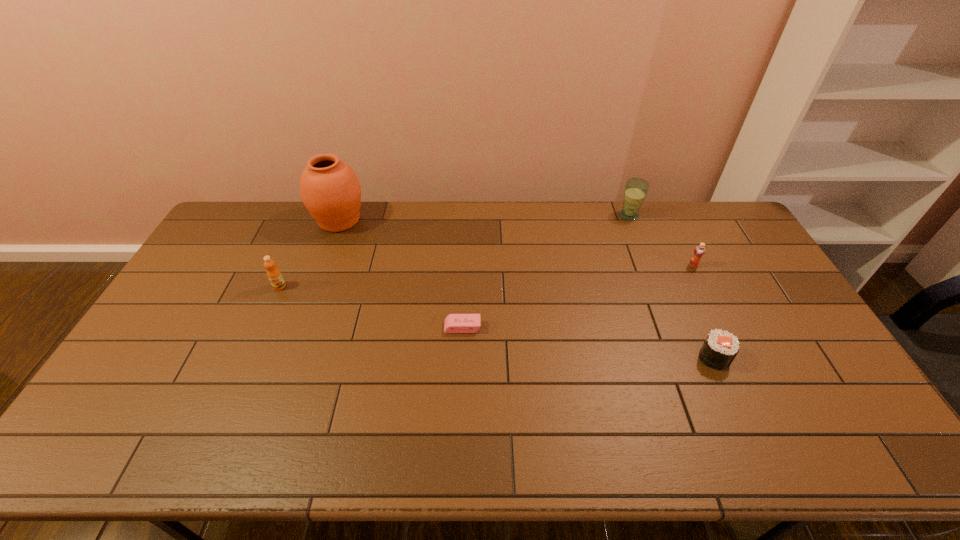
The height and width of the screenshot is (540, 960). In order to click on vacant space at the left edge in this screenshot , I will do `click(204, 303)`.

In the image, there is a desktop. Identify the location of vacant space at the right edge. The width and height of the screenshot is (960, 540). (771, 359).

The width and height of the screenshot is (960, 540). I want to click on free space between the nearest object and the eraser, so click(x=588, y=342).

Where is `free space between the left orange juice and the glass`? free space between the left orange juice and the glass is located at coordinates (454, 251).

You are a GUI agent. You are given a task and a screenshot of the screen. Output one action in this format:
    pyautogui.click(x=<x>, y=<y>)
    Task: Click on the free space between the fifth tallest object and the taller orange juice
    The image size is (960, 540).
    Given the screenshot: What is the action you would take?
    pyautogui.click(x=496, y=322)

The height and width of the screenshot is (540, 960). Identify the location of vacant space in between the glass and the taller orange juice. (454, 251).

The image size is (960, 540). I want to click on vacant point located between the fourth nearest object and the shortest object, so click(x=578, y=296).

Identify the location of free space between the second nearest object and the urn. (400, 274).

The width and height of the screenshot is (960, 540). In order to click on blank region between the taller orange juice and the third shortest object in this screenshot , I will do `click(487, 276)`.

I want to click on free spot between the fourth farthest object and the shortest object, so click(371, 307).